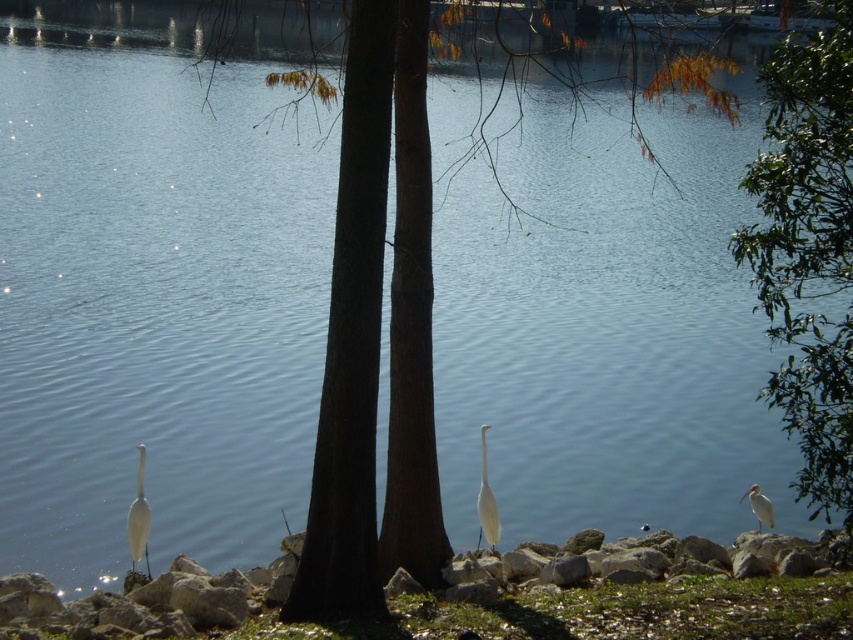
Question: Which point appears farthest from the camera in this image?

Choices:
 (A) (490, 513)
 (B) (804, 364)

Answer: (A)

Question: Among these points, which one is nearest to the camera?

Choices:
 (A) 772,509
 (B) 137,566
 (C) 482,428

Answer: (B)

Question: Can you confirm if green leafy tree at lower right is positioned to the right of white matte bird at lower right?

Choices:
 (A) yes
 (B) no

Answer: (A)

Question: Which point is closer to the camera?

Choices:
 (A) green leafy tree at lower right
 (B) white matte bird at lower right

Answer: (A)

Question: In this image, where is green leafy tree at lower right located relative to white matte bird at lower left?

Choices:
 (A) below
 (B) above

Answer: (B)

Question: Does white matte bird at center appear under white matte bird at lower right?

Choices:
 (A) yes
 (B) no

Answer: (B)